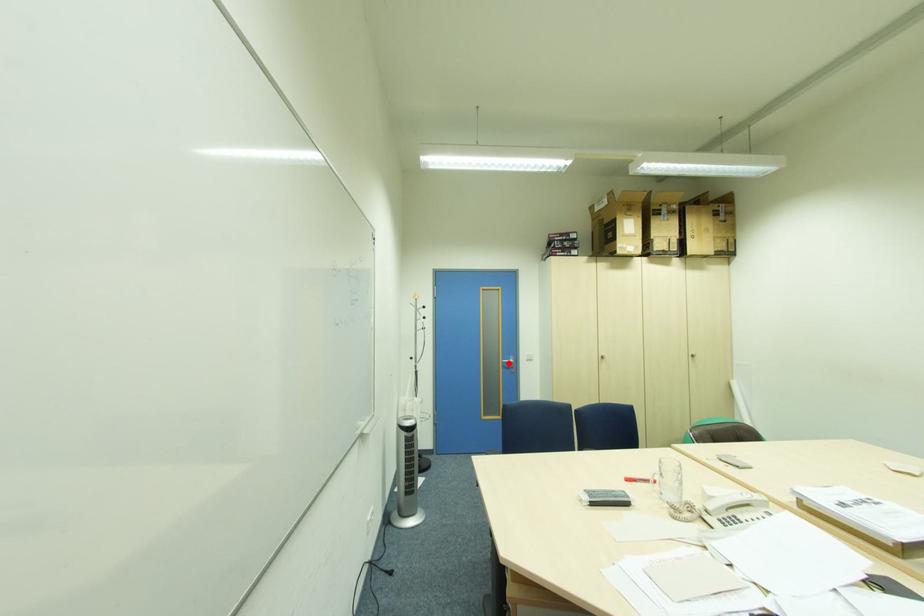
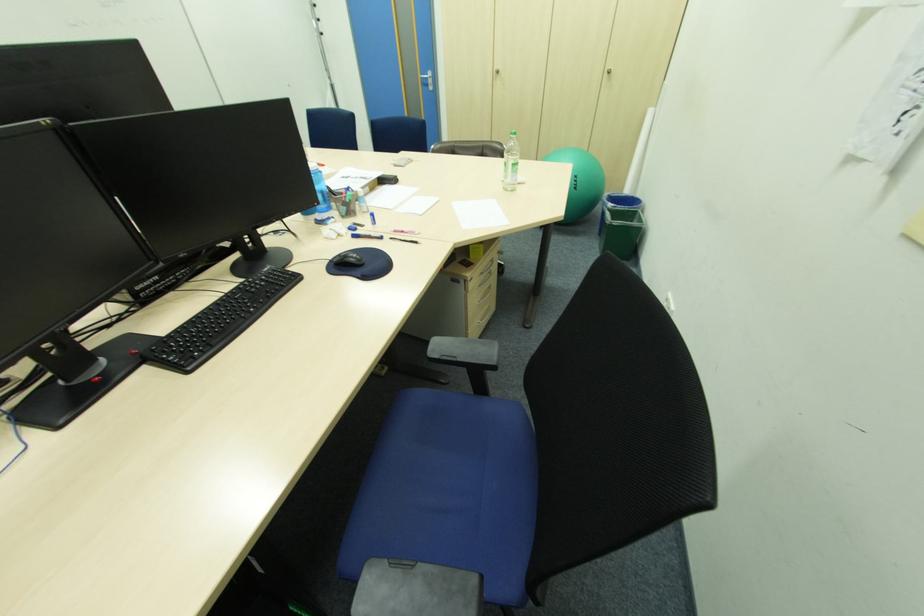
Locate, in the second image, the point that corresponds to the highlighted location in the first image.

(428, 79)